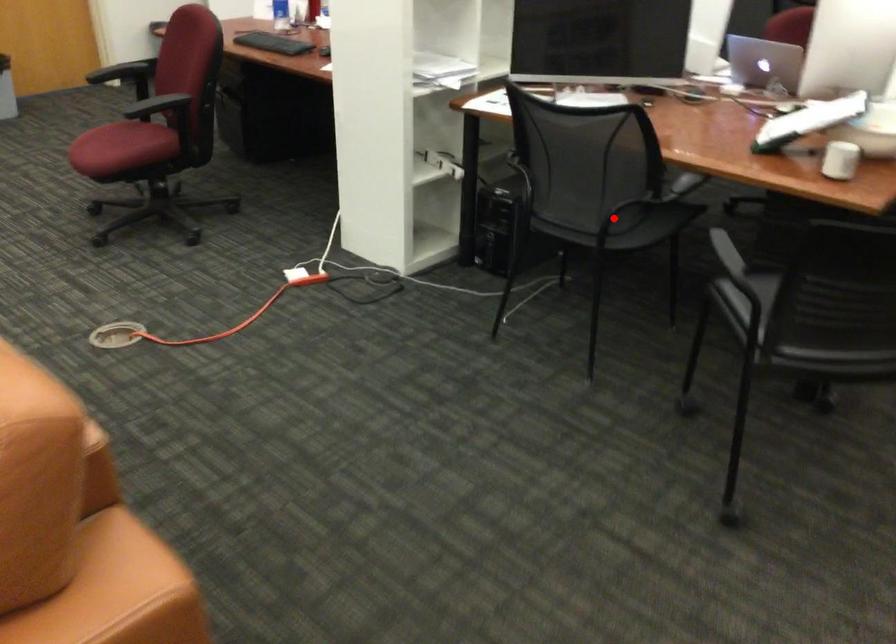
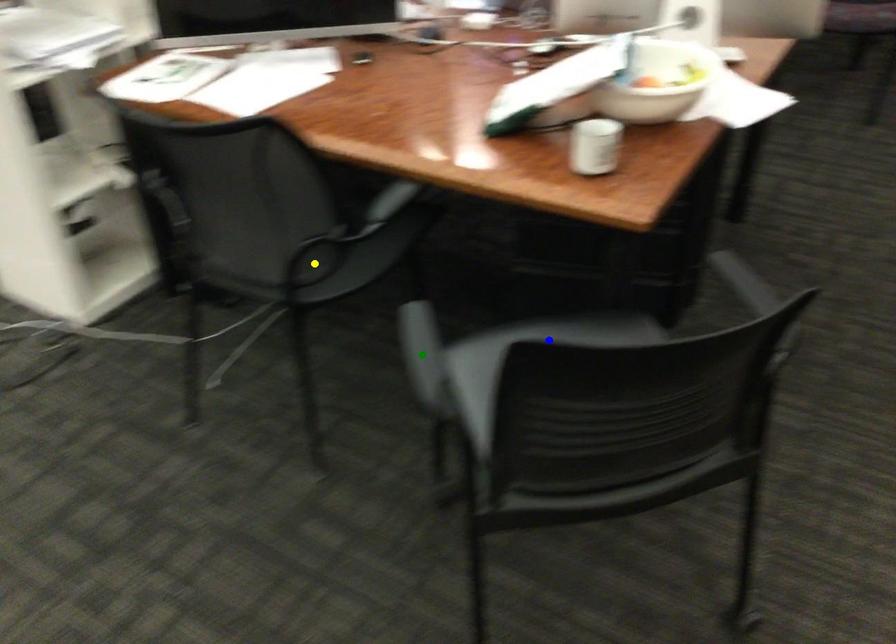
Question: I am providing you with two images of the same scene from different viewpoints. A red point is marked on the first image. You are given multiple points on the second image. Can you choose the point in image 2 that corresponds to the point in image 1?

Choices:
 (A) blue point
 (B) green point
 (C) yellow point

Answer: (C)